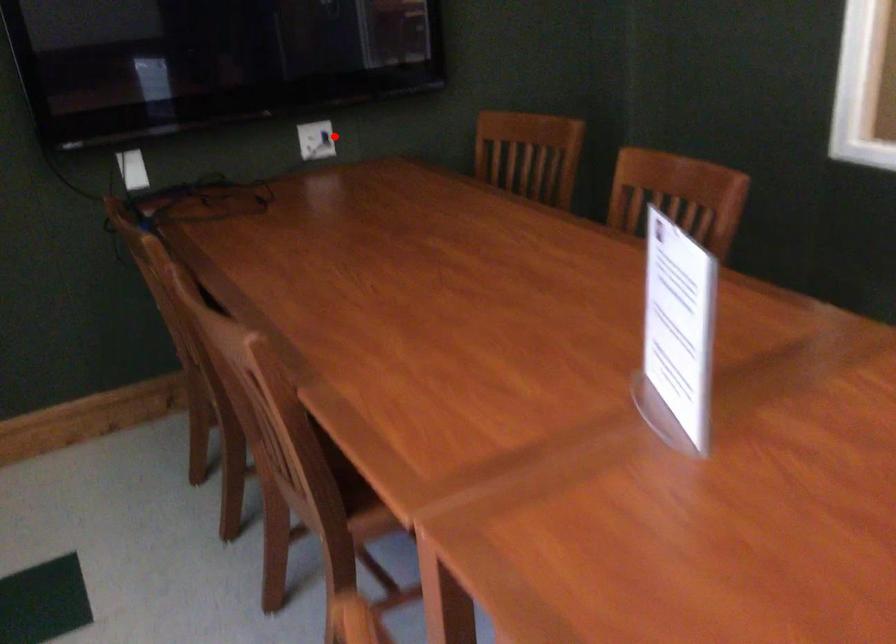
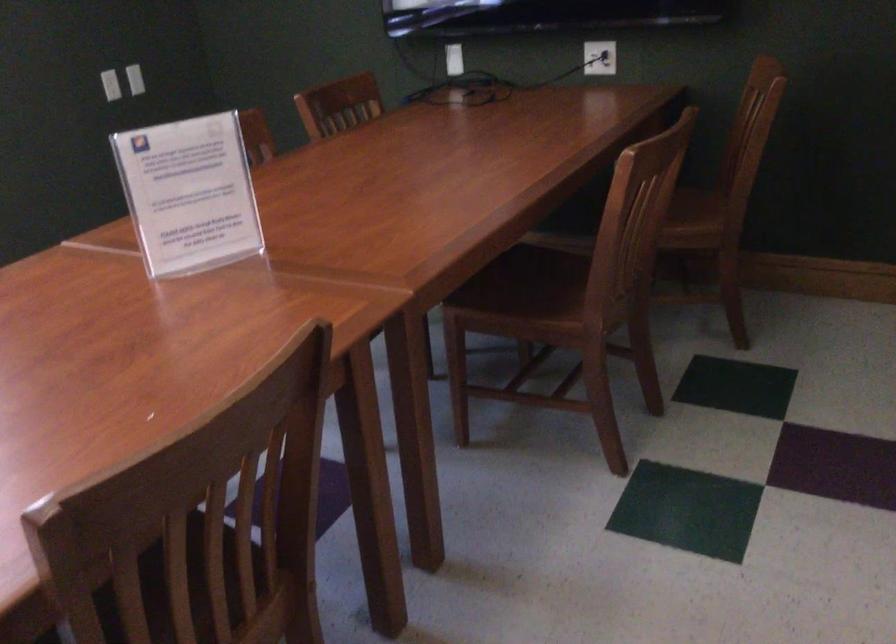
Find the pixel in the second image that matches the highlighted location in the first image.

(599, 58)